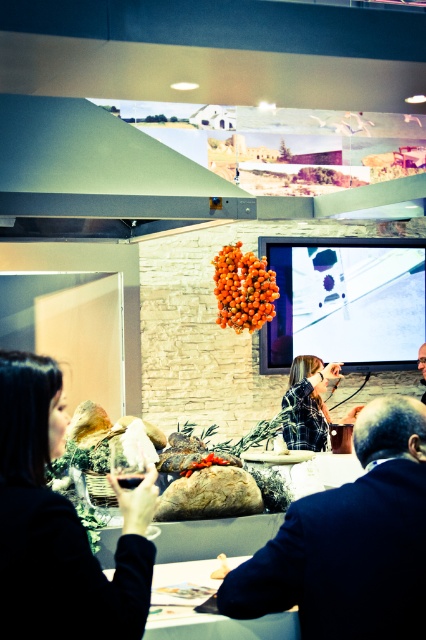
You are a server in a banquet hall and need to place a new centerpiece between the matte black wine glass at lower left and the orange matte cluster at center. Can you fit it if the centerpiece requires 4 meters of space between them?

The distance between the matte black wine glass at lower left and the orange matte cluster at center is 3.73 meters, which is less than the required 4 meters. Therefore, the centerpiece cannot be placed between them with the required spacing.

You are standing in the conference room and want to place a small plant on the table. The plant needs to be placed exactly at the coordinates given for the transparent glass at lower left. Where should you place the plant?

Place the plant at the coordinates point (132, 483), which is where the transparent glass at lower left is located.